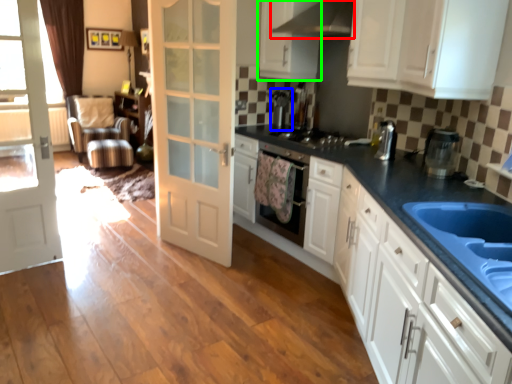
Question: Considering the real-world distances, which object is farthest from exhaust hood (highlighted by a red box)? coffee machine (highlighted by a blue box) or cabinetry (highlighted by a green box)?

Choices:
 (A) coffee machine
 (B) cabinetry

Answer: (A)